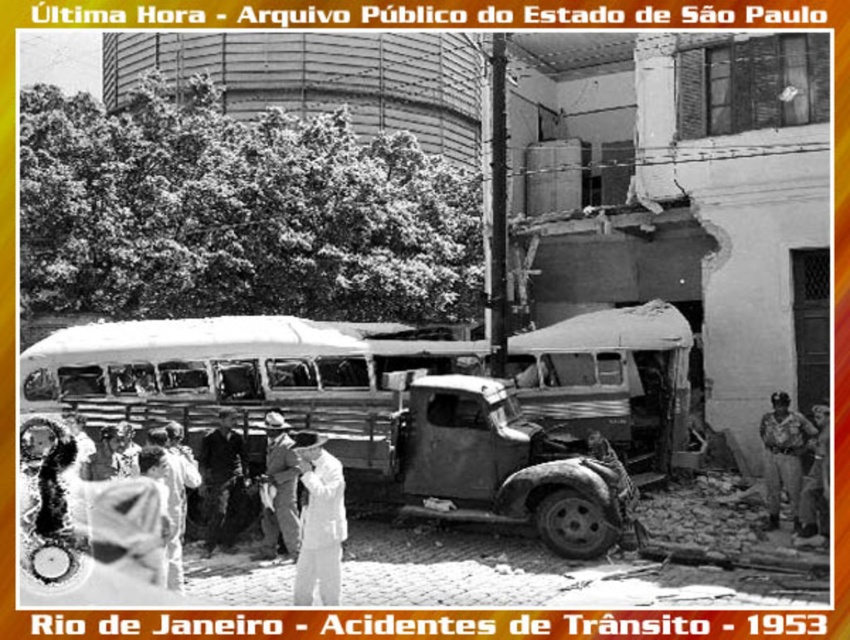
Question: Based on their relative distances, which object is farther from the rusty metal truck at center?

Choices:
 (A) dark fabric coat at center
 (B) white clothed person at center
 (C) white cloth shirt at lower right
 (D) khaki pants at right

Answer: (C)

Question: Which object appears farthest from the camera in this image?

Choices:
 (A) light brown leather hat at center
 (B) white clothed person at center

Answer: (A)

Question: Which point is farther to the camera?

Choices:
 (A) (775, 515)
 (B) (445, 477)

Answer: (A)

Question: Is light brown leather hat at center to the left of white cloth shirt at lower right from the viewer's perspective?

Choices:
 (A) yes
 (B) no

Answer: (A)

Question: Is khaki pants at right positioned before white cloth shirt at lower right?

Choices:
 (A) no
 (B) yes

Answer: (A)

Question: Considering the relative positions of light brown leather hat at center and white cloth shirt at lower right in the image provided, where is light brown leather hat at center located with respect to white cloth shirt at lower right?

Choices:
 (A) right
 (B) left

Answer: (B)